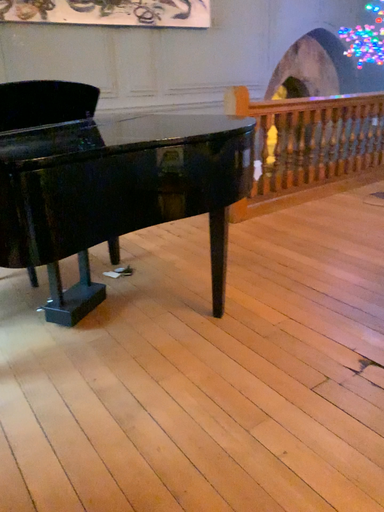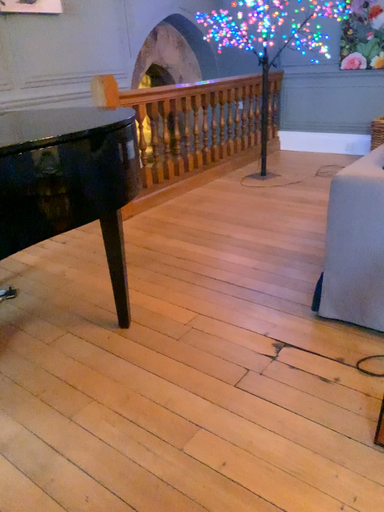
Question: Which way did the camera rotate in the video?

Choices:
 (A) rotated left
 (B) rotated right

Answer: (B)